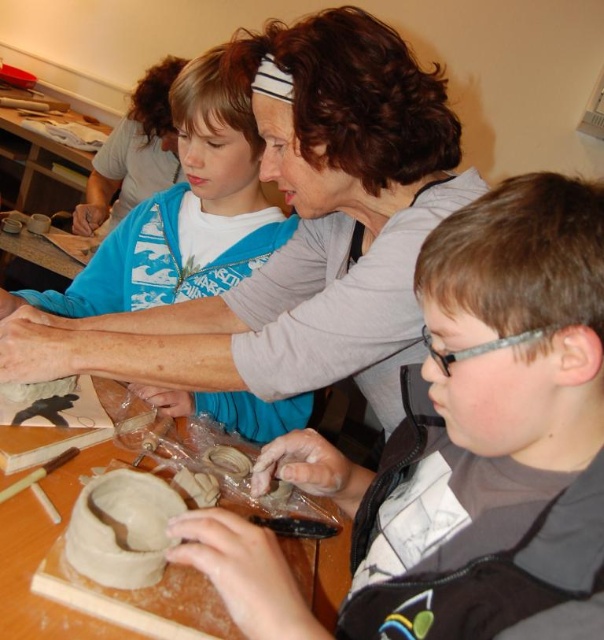
You are a pottery instructor observing the scene. You notice the matte gray clay at center and the blue fabric shirt at upper center. Which object is located lower in the image?

The matte gray clay at center is positioned under the blue fabric shirt at upper center, so it is lower in the image.

You are a pottery instructor observing the scene. You need to determine which object is larger between the matte gray clay at center and the blue fabric shirt at upper center. Based on the scene, which one is bigger?

The blue fabric shirt at upper center is larger than the matte gray clay at center.

Where is the matte gray clay at center located in the image?

The matte gray clay at center is located at point coordinates of 0.672 on the x axis and 0.801 on the y axis.